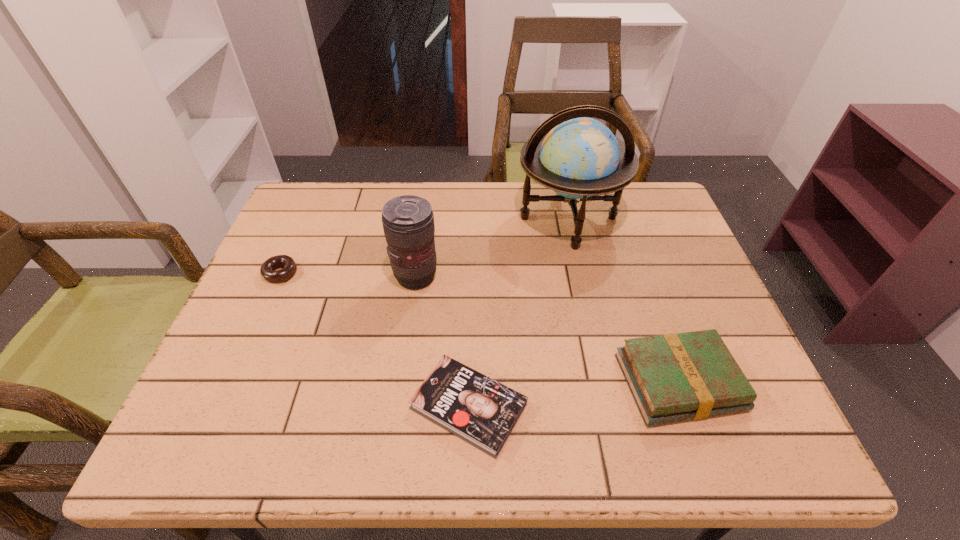
This screenshot has width=960, height=540. Find the location of `empty space between the shorter book and the third shortest object`. empty space between the shorter book and the third shortest object is located at coordinates (573, 394).

At what (x,y) coordinates should I click in order to perform the action: click on unoccupied position between the telephoto lens and the farthest object. Please return your answer as a coordinate pair (x, y). Looking at the image, I should click on (492, 247).

The image size is (960, 540). Identify the location of unoccupied position between the globe and the fourth shortest object. (492, 247).

The image size is (960, 540). I want to click on empty space between the telephoto lens and the doughnut, so click(x=348, y=275).

Find the location of `vacant region between the taller book and the doughnut`. vacant region between the taller book and the doughnut is located at coordinates (479, 327).

The image size is (960, 540). In order to click on object that can be found as the fourth closest to the globe in this screenshot , I will do `click(289, 266)`.

Image resolution: width=960 pixels, height=540 pixels. What are the coordinates of `object that stands as the closest to the left book` in the screenshot? It's located at (408, 221).

Find the location of `free location that satisfies the following two spatial constraints: 1. on the side of the telephoto lens where the control switches are located; 2. on the left side of the taller book`. free location that satisfies the following two spatial constraints: 1. on the side of the telephoto lens where the control switches are located; 2. on the left side of the taller book is located at coordinates (401, 382).

This screenshot has height=540, width=960. In order to click on vacant space that satisfies the following two spatial constraints: 1. on the side of the fourth shortest object where the control switches are located; 2. on the right side of the taller book in this screenshot , I will do `click(401, 382)`.

At what (x,y) coordinates should I click in order to perform the action: click on free space that satisfies the following two spatial constraints: 1. on the side of the telephoto lens where the control switches are located; 2. on the right side of the taller book. Please return your answer as a coordinate pair (x, y). Looking at the image, I should click on (401, 382).